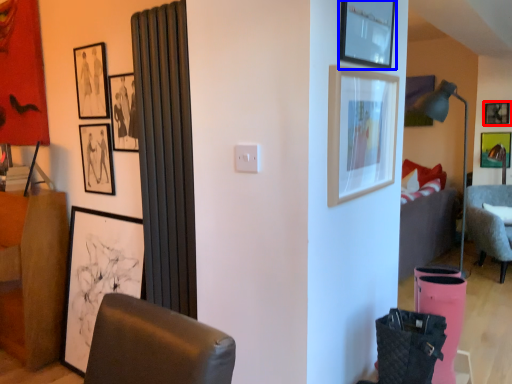
Question: Among these objects, which one is farthest to the camera, picture frame (highlighted by a red box) or picture frame (highlighted by a blue box)?

Choices:
 (A) picture frame
 (B) picture frame

Answer: (A)